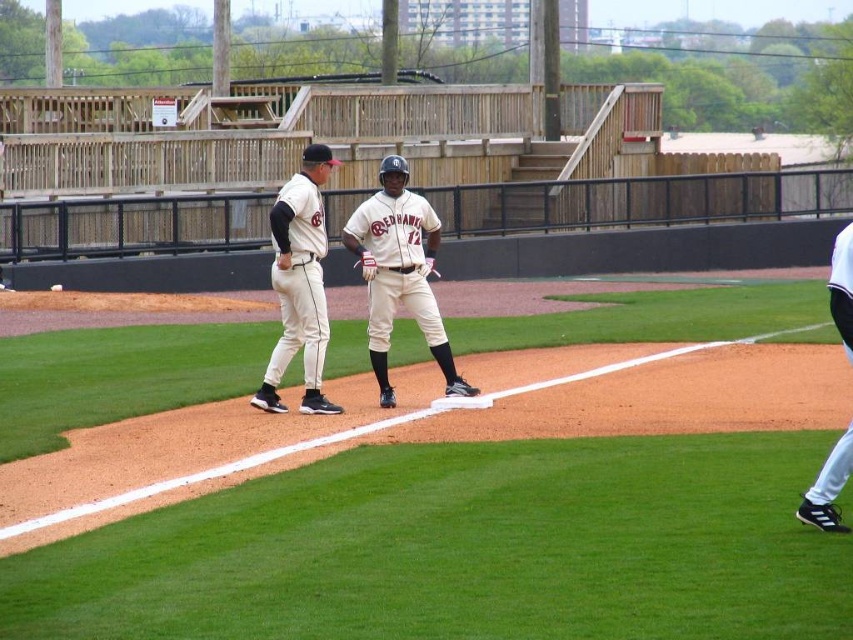
Question: Can you confirm if white uniformed players at center is smaller than white matte uniform at center?

Choices:
 (A) yes
 (B) no

Answer: (B)

Question: Does white matte uniform at center appear over white leather baseball glove at lower right?

Choices:
 (A) yes
 (B) no

Answer: (A)

Question: Estimate the real-world distances between objects in this image. Which object is farther from the white matte uniform at center?

Choices:
 (A) white uniformed players at center
 (B) white uniform at center
 (C) brown leather glove at center

Answer: (A)

Question: Which point appears closest to the camera in this image?

Choices:
 (A) (289, 291)
 (B) (35, 637)

Answer: (B)

Question: Among these points, which one is farthest from the camera?

Choices:
 (A) (422, 209)
 (B) (828, 291)

Answer: (A)

Question: Does white uniform at center have a greater width compared to white matte uniform at center?

Choices:
 (A) yes
 (B) no

Answer: (A)